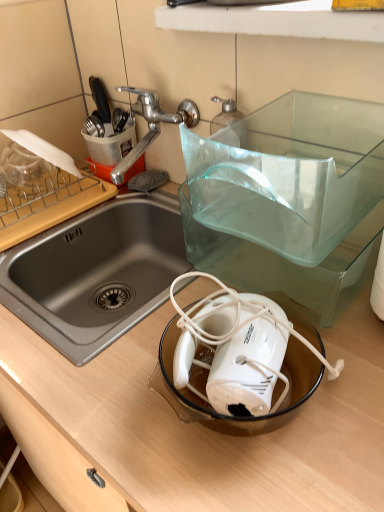
Question: Is wooden cutting board at left further to the viewer compared to white plastic mixer at center?

Choices:
 (A) no
 (B) yes

Answer: (B)

Question: Is wooden cutting board at left with white plastic mixer at center?

Choices:
 (A) no
 (B) yes

Answer: (A)

Question: From the image's perspective, is wooden cutting board at left below white plastic mixer at center?

Choices:
 (A) no
 (B) yes

Answer: (A)

Question: Does wooden cutting board at left appear on the right side of white plastic mixer at center?

Choices:
 (A) no
 (B) yes

Answer: (A)

Question: From a real-world perspective, does wooden cutting board at left stand above white plastic mixer at center?

Choices:
 (A) no
 (B) yes

Answer: (A)

Question: From a real-world perspective, is white plastic mixer at center positioned above or below silver metallic tap at upper left?

Choices:
 (A) above
 (B) below

Answer: (B)

Question: In terms of size, does white plastic mixer at center appear bigger or smaller than silver metallic tap at upper left?

Choices:
 (A) small
 (B) big

Answer: (A)

Question: From the image's perspective, is white plastic mixer at center positioned above or below silver metallic tap at upper left?

Choices:
 (A) below
 (B) above

Answer: (A)

Question: Considering the positions of white plastic mixer at center and silver metallic tap at upper left in the image, is white plastic mixer at center wider or thinner than silver metallic tap at upper left?

Choices:
 (A) thin
 (B) wide

Answer: (A)

Question: Is wooden counter at center wider or thinner than silver metallic tap at upper left?

Choices:
 (A) wide
 (B) thin

Answer: (A)

Question: Relative to silver metallic tap at upper left, is wooden counter at center in front or behind?

Choices:
 (A) front
 (B) behind

Answer: (A)

Question: Is wooden counter at center inside or outside of silver metallic tap at upper left?

Choices:
 (A) inside
 (B) outside

Answer: (B)

Question: From the image's perspective, is wooden counter at center positioned above or below silver metallic tap at upper left?

Choices:
 (A) below
 (B) above

Answer: (A)

Question: Looking at the image, does silver metallic tap at upper left seem bigger or smaller compared to wooden counter at center?

Choices:
 (A) small
 (B) big

Answer: (A)

Question: Considering the positions of point (150, 99) and point (69, 507), is point (150, 99) closer or farther from the camera than point (69, 507)?

Choices:
 (A) closer
 (B) farther

Answer: (A)